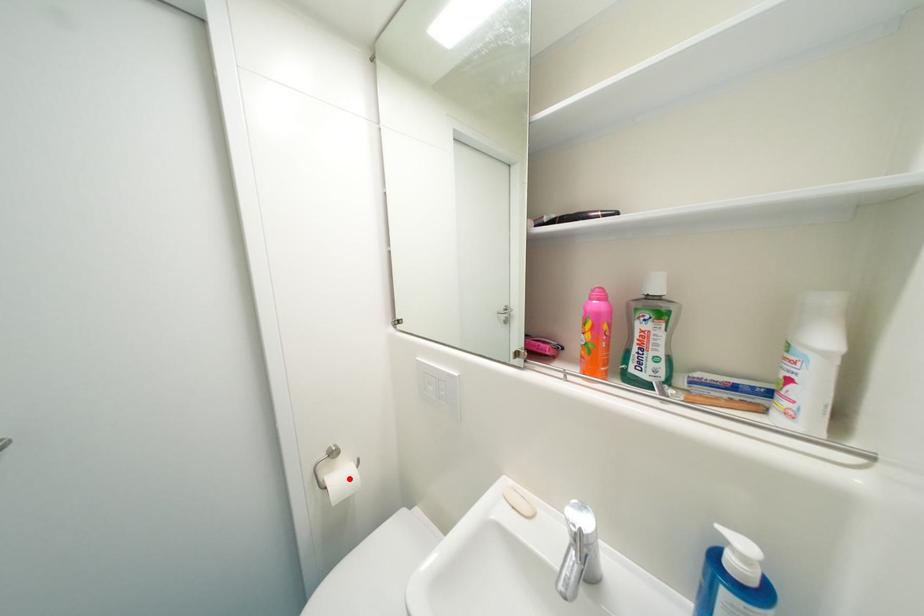
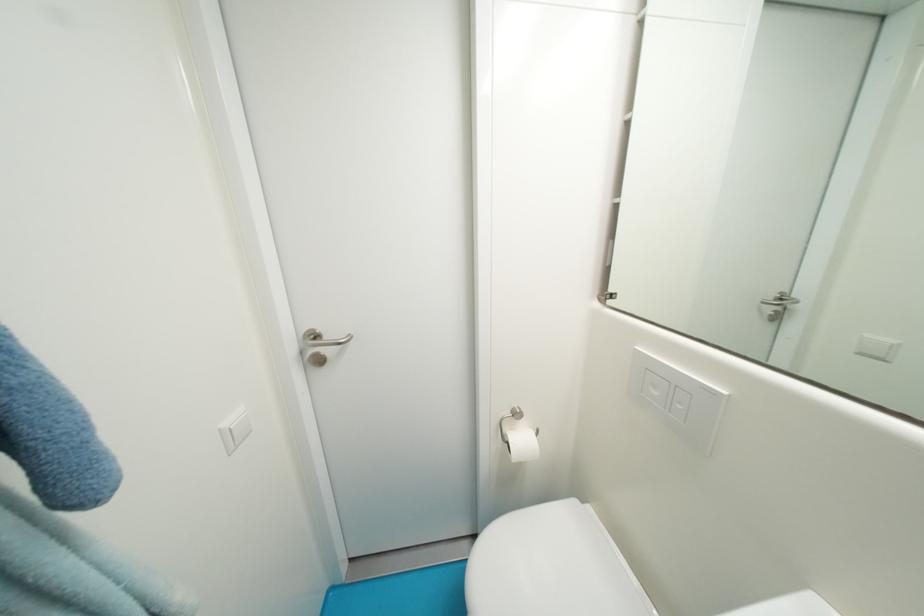
Where in the second image is the point corresponding to the highlighted location from the first image?

(529, 442)